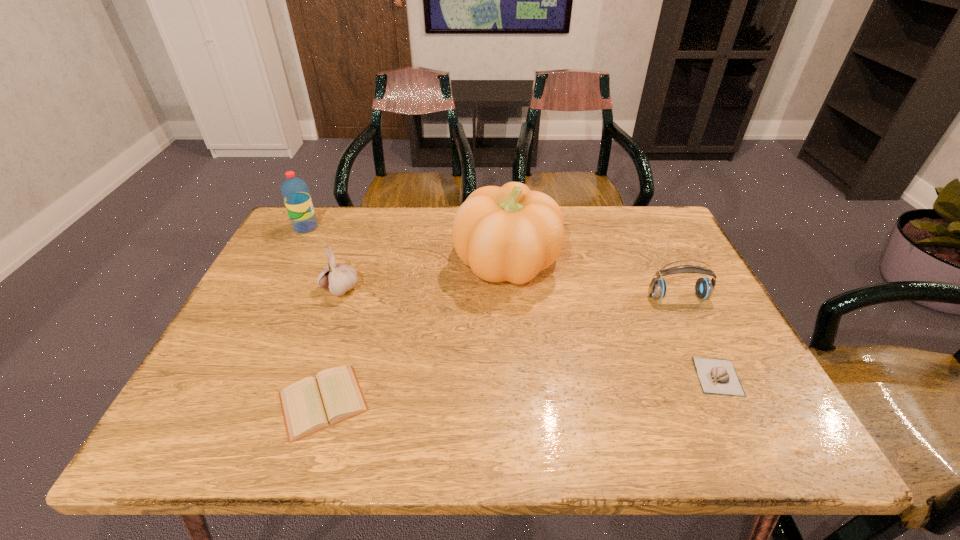
At what (x,y) coordinates should I click in order to perform the action: click on the fourth object from left to right. Please return your answer as a coordinate pair (x, y). Looking at the image, I should click on (510, 233).

Where is `the tallest object`? the tallest object is located at coordinates (510, 233).

Find the location of a particular element. Image resolution: width=960 pixels, height=540 pixels. water bottle is located at coordinates (295, 192).

Where is `the leftmost object`? the leftmost object is located at coordinates (295, 192).

Locate an element on the screen. The height and width of the screenshot is (540, 960). the left garlic is located at coordinates (337, 277).

I want to click on the farther garlic, so click(x=337, y=277).

This screenshot has width=960, height=540. In order to click on headset in this screenshot , I will do `click(704, 287)`.

Where is `the right garlic`? The image size is (960, 540). the right garlic is located at coordinates (716, 376).

The width and height of the screenshot is (960, 540). What are the coordinates of `the shorter garlic` in the screenshot? It's located at (716, 376).

The image size is (960, 540). I want to click on diary, so click(311, 404).